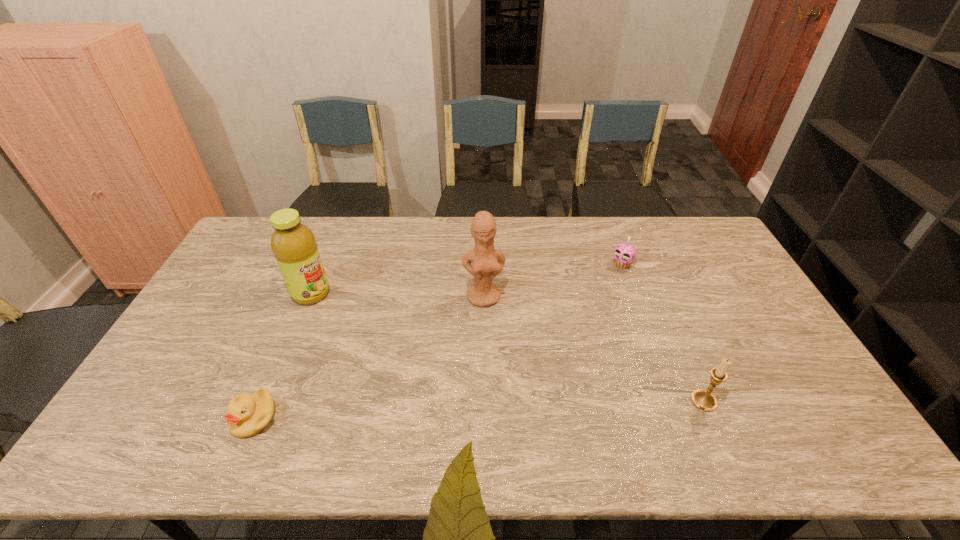
Find the location of a particular element. The width and height of the screenshot is (960, 540). vacant spot on the desktop that is between the duckling and the rightmost object and is positioned on the front-facing side of the figurine is located at coordinates (503, 408).

Locate an element on the screen. This screenshot has height=540, width=960. free space on the desktop that is between the duckling and the rightmost object and is positioned on the front label of the fruit juice is located at coordinates (493, 408).

The width and height of the screenshot is (960, 540). In order to click on free space on the desktop that is between the shortest object and the candle holder and is positioned on the face of the farthest object in this screenshot , I will do `click(485, 409)`.